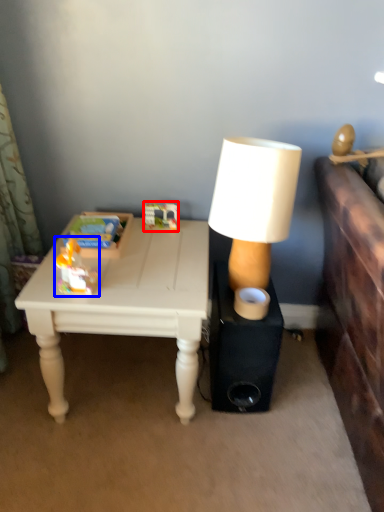
Question: Which object is closer to the camera taking this photo, toy (highlighted by a red box) or toy (highlighted by a blue box)?

Choices:
 (A) toy
 (B) toy

Answer: (B)